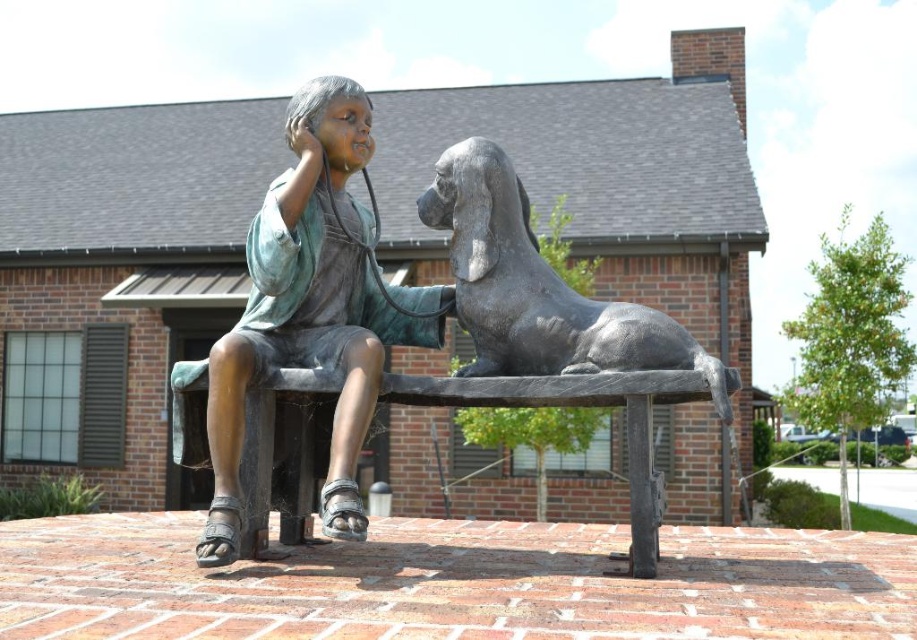
You are an art curator planning to display the bronze statue of child at center and the bronze bench at center in a gallery. Given that the gallery has limited space, which object should you prioritize placing first to ensure both can fit comfortably?

The bronze statue of child at center is larger in size than the bronze bench at center, so you should prioritize placing the bronze statue of child at center first to ensure there is enough space for both.

You are a maintenance worker checking the bronze statue of dog at center and the bronze bench at center. Which object is positioned higher in the image?

The bronze statue of dog at center is above the bronze bench at center, so the bronze statue of dog at center is positioned higher.